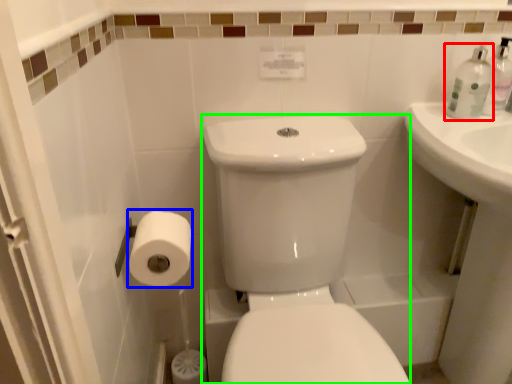
Question: Considering the real-world distances, which object is closest to toiletry (highlighted by a red box)? toilet paper (highlighted by a blue box) or porcelain (highlighted by a green box).

Choices:
 (A) toilet paper
 (B) porcelain

Answer: (B)